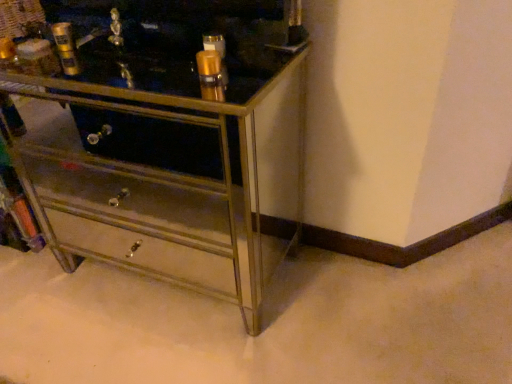
At what (x,y) coordinates should I click in order to perform the action: click on free space on the front side of metallic mirrored chest of drawers at center. Please return your answer as a coordinate pair (x, y). This screenshot has height=384, width=512. Looking at the image, I should click on (165, 350).